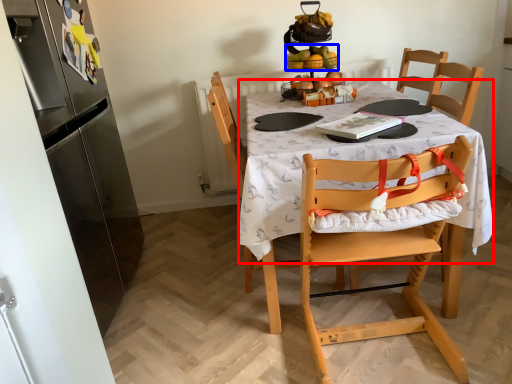
Question: Which of the following is the farthest to the observer, round table (highlighted by a red box) or fruit (highlighted by a blue box)?

Choices:
 (A) round table
 (B) fruit

Answer: (B)